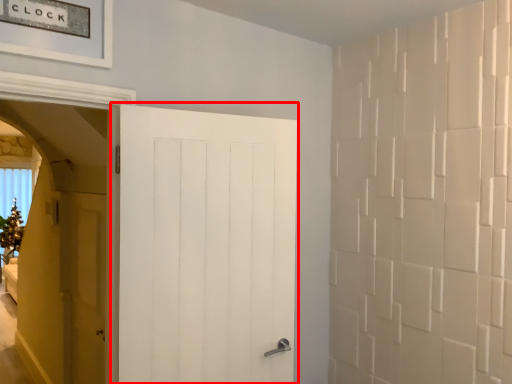
Question: Observing the image, what is the correct spatial positioning of door (annotated by the red box) in reference to door?

Choices:
 (A) left
 (B) right

Answer: (B)